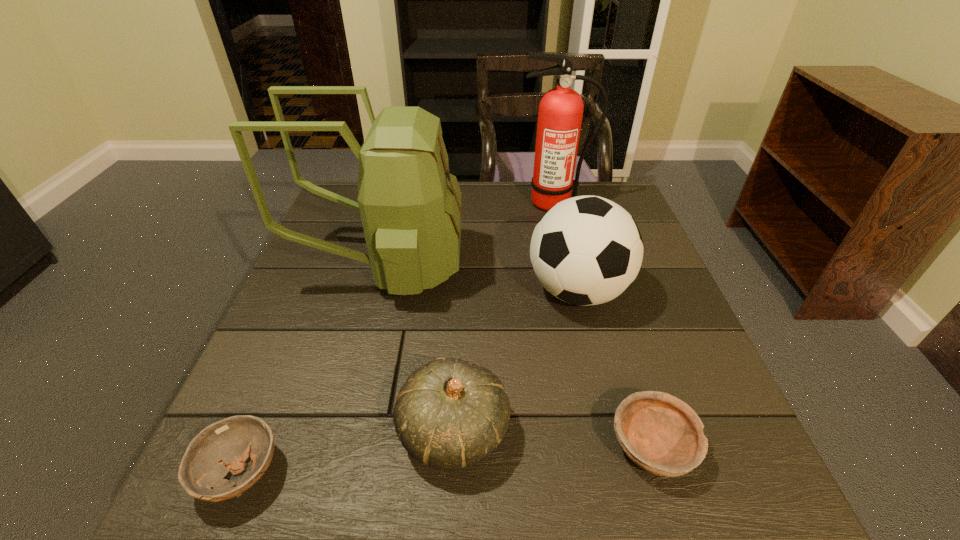
In order to click on object that is positioned at the far right corner in this screenshot , I will do `click(560, 114)`.

Image resolution: width=960 pixels, height=540 pixels. I want to click on object located at the near right corner, so click(x=660, y=433).

Locate an element on the screen. The width and height of the screenshot is (960, 540). vacant space at the far edge is located at coordinates (501, 193).

In the image, there is a desktop. Find the location of `vacant region at the left edge`. vacant region at the left edge is located at coordinates (252, 395).

Locate an element on the screen. vacant region at the right edge is located at coordinates (630, 318).

Where is `vacant space at the far left corner`? vacant space at the far left corner is located at coordinates (331, 214).

Identify the location of vacant region between the fire extinguisher and the backpack. (469, 235).

At what (x,y) coordinates should I click in order to perform the action: click on free area in between the fire extinguisher and the fourth tallest object. Please return your answer as a coordinate pair (x, y). This screenshot has height=540, width=960. Looking at the image, I should click on (504, 318).

Identify the location of vacant area that lies between the right bowl and the farthest object. The image size is (960, 540). (603, 325).

Find the location of a particular element. free spot between the backpack and the left bowl is located at coordinates [312, 370].